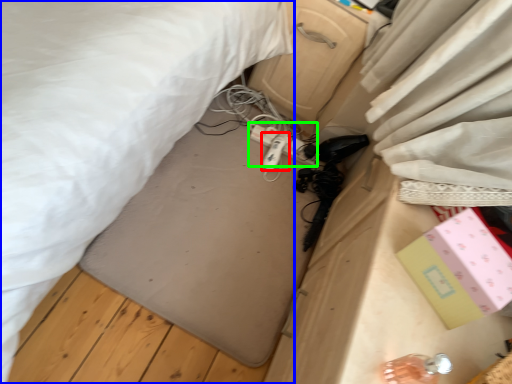
Question: Which object is the farthest from equipment (highlighted by a red box)? Choose among these: bed (highlighted by a blue box) or extension cord (highlighted by a green box).

Choices:
 (A) bed
 (B) extension cord

Answer: (A)